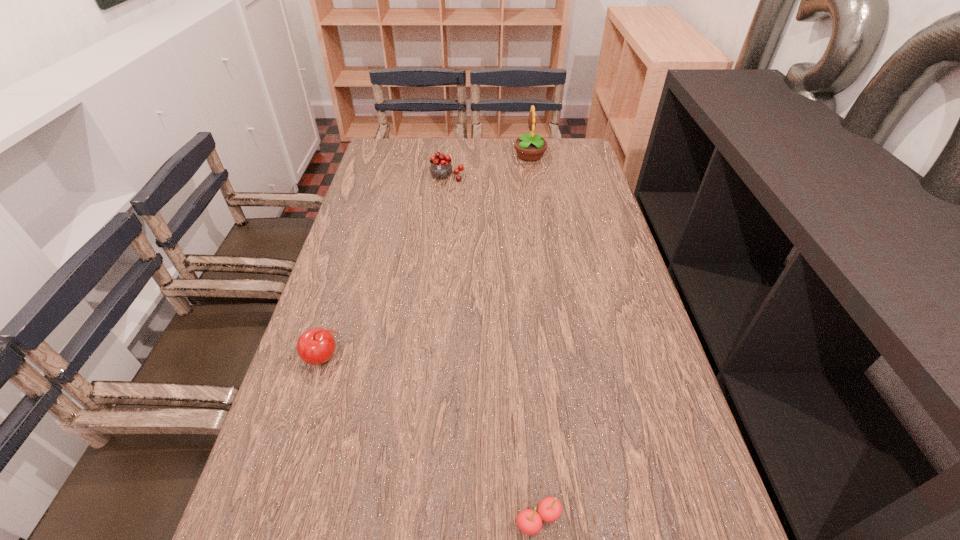
Locate an element on the screen. free point located 0.240m on the face of the tallest object is located at coordinates (449, 156).

Where is `vacant space located on the handle side of the third nearest object`? vacant space located on the handle side of the third nearest object is located at coordinates (440, 248).

Identify the location of free space located on the front of the second farthest cherry. (275, 523).

Locate an element on the screen. blank space located on the back of the nearest cherry is located at coordinates (521, 326).

Identify the location of sunflower located in the far edge section of the desktop. The width and height of the screenshot is (960, 540). (530, 147).

Identify the location of cherry present at the far edge. (440, 168).

Image resolution: width=960 pixels, height=540 pixels. I want to click on object that is positioned at the left edge, so click(x=316, y=346).

Find the location of a particular element. This screenshot has width=960, height=540. object positioned at the right edge is located at coordinates (530, 147).

In order to click on object situated at the far right corner in this screenshot , I will do `click(530, 147)`.

In the image, there is a desktop. Where is `vacant space at the far edge`? The height and width of the screenshot is (540, 960). vacant space at the far edge is located at coordinates (437, 148).